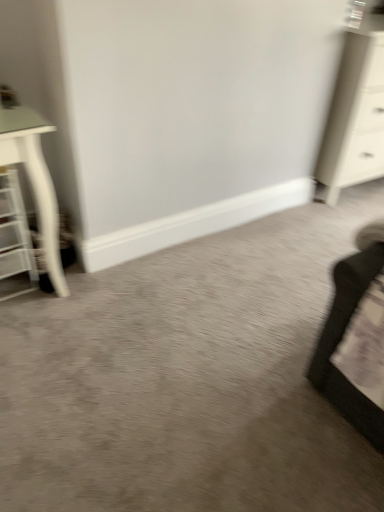
Question: Is white glossy chest of drawers at upper right further to camera compared to white mesh shelf at left?

Choices:
 (A) no
 (B) yes

Answer: (B)

Question: Does white glossy chest of drawers at upper right have a greater height compared to white mesh shelf at left?

Choices:
 (A) yes
 (B) no

Answer: (A)

Question: Considering the relative sizes of white glossy chest of drawers at upper right and white mesh shelf at left in the image provided, is white glossy chest of drawers at upper right wider than white mesh shelf at left?

Choices:
 (A) no
 (B) yes

Answer: (B)

Question: Can you confirm if white glossy chest of drawers at upper right is bigger than white mesh shelf at left?

Choices:
 (A) no
 (B) yes

Answer: (B)

Question: Is white glossy chest of drawers at upper right beside white mesh shelf at left?

Choices:
 (A) yes
 (B) no

Answer: (B)

Question: Does white glossy chest of drawers at upper right have a smaller size compared to white mesh shelf at left?

Choices:
 (A) no
 (B) yes

Answer: (A)

Question: Is white mesh shelf at left at the left side of white glossy chest of drawers at upper right?

Choices:
 (A) yes
 (B) no

Answer: (A)

Question: Considering the relative sizes of white mesh shelf at left and white glossy chest of drawers at upper right in the image provided, is white mesh shelf at left wider than white glossy chest of drawers at upper right?

Choices:
 (A) no
 (B) yes

Answer: (A)

Question: Is white mesh shelf at left outside white glossy chest of drawers at upper right?

Choices:
 (A) yes
 (B) no

Answer: (A)

Question: Does white mesh shelf at left have a lesser width compared to white glossy chest of drawers at upper right?

Choices:
 (A) yes
 (B) no

Answer: (A)

Question: Is the position of white mesh shelf at left more distant than that of white glossy chest of drawers at upper right?

Choices:
 (A) yes
 (B) no

Answer: (B)

Question: Are white mesh shelf at left and white glossy chest of drawers at upper right making contact?

Choices:
 (A) no
 (B) yes

Answer: (A)

Question: In terms of height, does white glossy chest of drawers at upper right look taller or shorter compared to white mesh shelf at left?

Choices:
 (A) tall
 (B) short

Answer: (A)